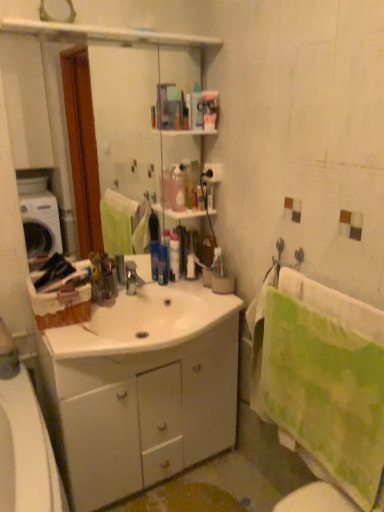
Question: Is green textured towel at right taller or shorter than translucent plastic toothbrush at upper center, acting as the fourth toiletry starting from the left?

Choices:
 (A) tall
 (B) short

Answer: (A)

Question: In terms of width, does green textured towel at right look wider or thinner when compared to translucent plastic toothbrush at upper center, acting as the fourth toiletry starting from the left?

Choices:
 (A) thin
 (B) wide

Answer: (B)

Question: Considering the real-world distances, which object is farthest from the metallic silver faucet at center?

Choices:
 (A) translucent plastic container at center, marked as the 2th toiletry in a right-to-left arrangement
 (B) translucent plastic toothbrush at upper center, the 1th toiletry in the right-to-left sequence
 (C) white glossy cabinet at center
 (D) clear glass mirror at upper center
 (E) white matte toilet paper at center

Answer: (D)

Question: Estimate the real-world distances between objects in this image. Which object is farther from the white glossy cabinet at center?

Choices:
 (A) green textured towel at right
 (B) metallic silver faucet at center
 (C) translucent plastic container at center, marked as the 2th toiletry in a right-to-left arrangement
 (D) clear glass mirror at upper center
 (E) blue glossy bottle at center, the 1th toiletry when ordered from left to right

Answer: (D)